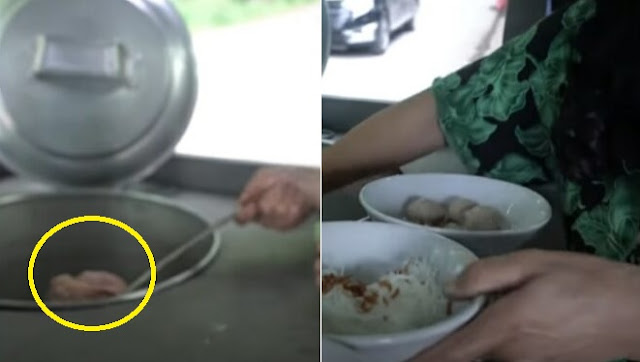
Locate an element on the screen. counter top is located at coordinates (269, 297), (340, 196).